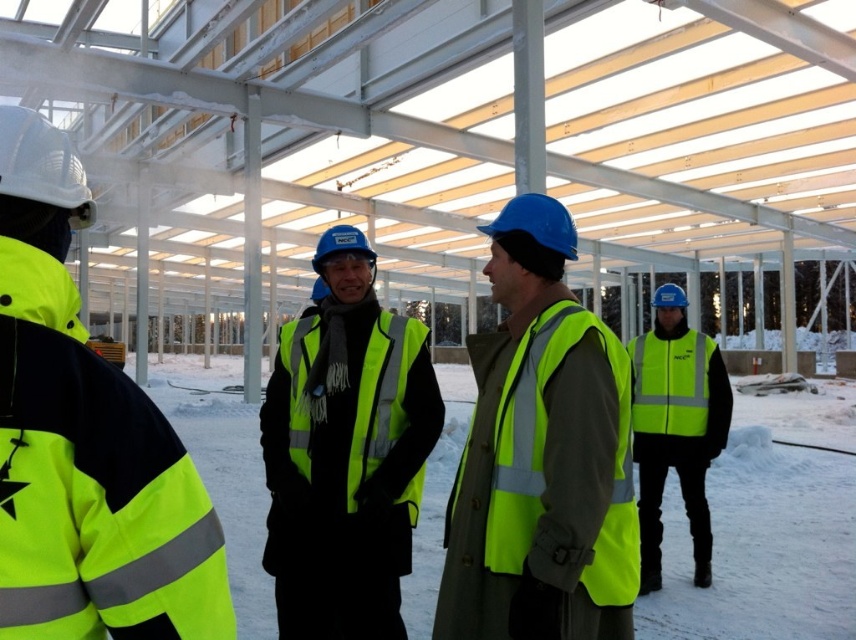
Question: Which object appears closest to the camera in this image?

Choices:
 (A) high visibility yellow vest at center
 (B) high-visibility yellow vest at center
 (C) high-visibility fabric vest at center
 (D) neon yellow reflective jacket at left

Answer: (D)

Question: Is high visibility yellow vest at center bigger than high-visibility fabric safety vest at center?

Choices:
 (A) yes
 (B) no

Answer: (A)

Question: Is high-visibility fabric vest at center smaller than high-visibility fabric safety vest at center-right?

Choices:
 (A) yes
 (B) no

Answer: (B)

Question: Considering the real-world distances, which object is closest to the high visibility yellow vest at center?

Choices:
 (A) high-visibility fabric safety vest at center
 (B) neon yellow reflective jacket at left
 (C) high-visibility fabric safety vest at center-right

Answer: (C)

Question: Is high-visibility fabric safety vest at center below high-visibility fabric safety vest at center-right?

Choices:
 (A) yes
 (B) no

Answer: (B)

Question: Which object is farther from the camera taking this photo?

Choices:
 (A) neon yellow reflective jacket at left
 (B) high-visibility fabric safety vest at center

Answer: (B)